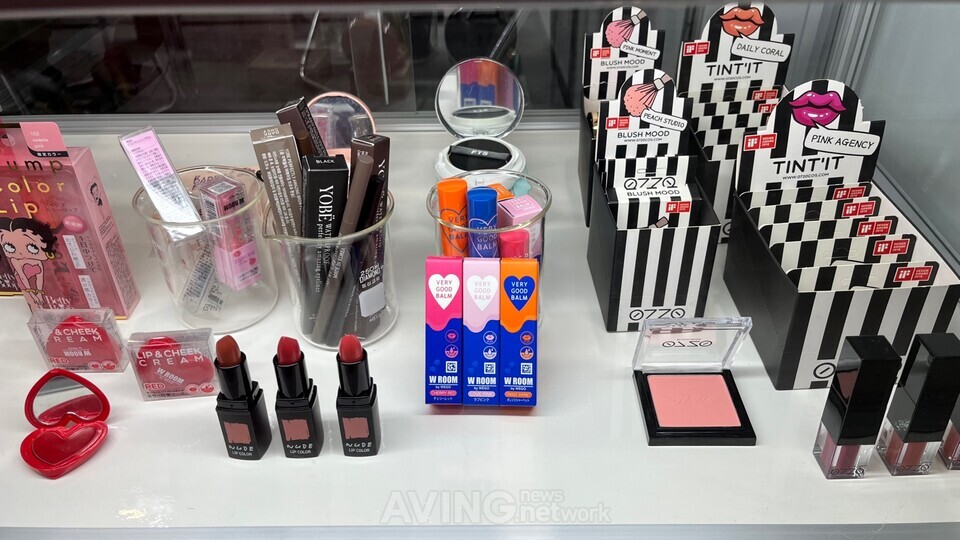
Locate an element on the screen. glass jars is located at coordinates (207, 262), (328, 297), (523, 225).